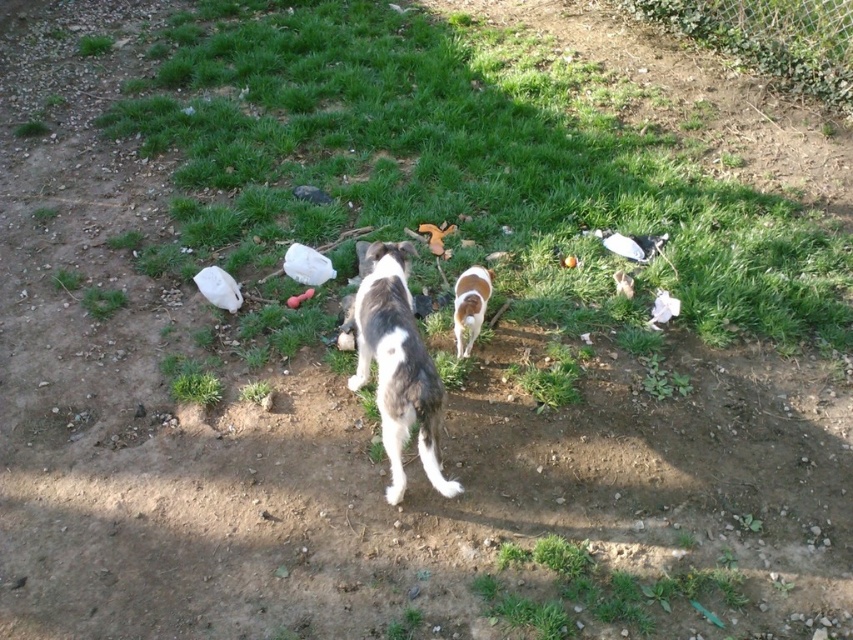
Does point (364, 333) come farther from viewer compared to point (463, 348)?

No.

Is white fur dog at center closer to camera compared to brown and white fur at center?

Yes, it is in front of brown and white fur at center.

The width and height of the screenshot is (853, 640). What are the coordinates of `white fur dog at center` in the screenshot? It's located at (397, 365).

Locate an element on the screen. white fur dog at center is located at coordinates (397, 365).